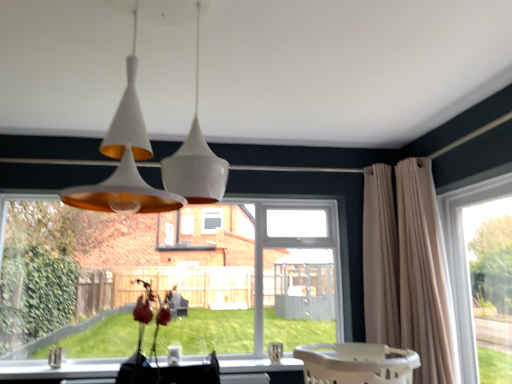
Question: Is clear glass window at lower left, marked as the second window in a right-to-left arrangement, surrounded by transparent glass window at right, the first window when ordered from right to left?

Choices:
 (A) no
 (B) yes

Answer: (A)

Question: Considering the relative sizes of transparent glass window at right, the first window when ordered from right to left, and clear glass window at lower left, positioned as the first window in left-to-right order, in the image provided, is transparent glass window at right, the first window when ordered from right to left, smaller than clear glass window at lower left, positioned as the first window in left-to-right order,?

Choices:
 (A) no
 (B) yes

Answer: (B)

Question: Is transparent glass window at right, which is the second window in left-to-right order, behind clear glass window at lower left, marked as the second window in a right-to-left arrangement?

Choices:
 (A) yes
 (B) no

Answer: (B)

Question: Considering the relative sizes of transparent glass window at right, which is the second window in left-to-right order, and clear glass window at lower left, positioned as the first window in left-to-right order, in the image provided, is transparent glass window at right, which is the second window in left-to-right order, wider than clear glass window at lower left, positioned as the first window in left-to-right order,?

Choices:
 (A) no
 (B) yes

Answer: (A)

Question: Considering the relative positions of transparent glass window at right, the first window when ordered from right to left, and clear glass window at lower left, marked as the second window in a right-to-left arrangement, in the image provided, is transparent glass window at right, the first window when ordered from right to left, to the right of clear glass window at lower left, marked as the second window in a right-to-left arrangement, from the viewer's perspective?

Choices:
 (A) no
 (B) yes

Answer: (B)

Question: From the image's perspective, is beige plastic baby carriage at lower center above or below beige fabric curtain at right, which ranks as the 2th curtain in left-to-right order?

Choices:
 (A) below
 (B) above

Answer: (A)

Question: Looking at the image, does beige plastic baby carriage at lower center seem bigger or smaller compared to beige fabric curtain at right, acting as the 1th curtain starting from the right?

Choices:
 (A) small
 (B) big

Answer: (A)

Question: From their relative heights in the image, would you say beige plastic baby carriage at lower center is taller or shorter than beige fabric curtain at right, which ranks as the 2th curtain in left-to-right order?

Choices:
 (A) short
 (B) tall

Answer: (A)

Question: Does point (x=358, y=380) appear closer or farther from the camera than point (x=448, y=288)?

Choices:
 (A) farther
 (B) closer

Answer: (B)

Question: From a real-world perspective, relative to beige plastic baby carriage at lower center, is beige fabric curtain at right, which is the 2th curtain from right to left, vertically above or below?

Choices:
 (A) above
 (B) below

Answer: (A)

Question: Considering the positions of beige fabric curtain at right, which is the 2th curtain from right to left, and beige plastic baby carriage at lower center in the image, is beige fabric curtain at right, which is the 2th curtain from right to left, bigger or smaller than beige plastic baby carriage at lower center?

Choices:
 (A) small
 (B) big

Answer: (B)

Question: Is beige fabric curtain at right, marked as the 1th curtain in a left-to-right arrangement, taller or shorter than beige plastic baby carriage at lower center?

Choices:
 (A) short
 (B) tall

Answer: (B)

Question: Is beige fabric curtain at right, which is the 2th curtain from right to left, situated inside beige plastic baby carriage at lower center or outside?

Choices:
 (A) inside
 (B) outside

Answer: (B)

Question: In the image, is clear glass window at lower left, marked as the second window in a right-to-left arrangement, positioned in front of or behind beige fabric curtain at right, acting as the 1th curtain starting from the right?

Choices:
 (A) behind
 (B) front

Answer: (A)

Question: Is clear glass window at lower left, positioned as the first window in left-to-right order, inside the boundaries of beige fabric curtain at right, which ranks as the 2th curtain in left-to-right order, or outside?

Choices:
 (A) outside
 (B) inside

Answer: (A)